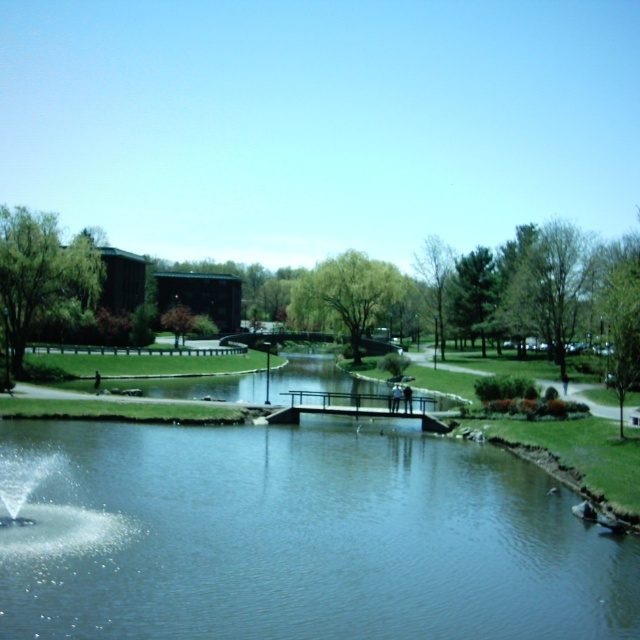
Which of these two, clear water at center or clear water fountain at lower left, stands shorter?

Standing shorter between the two is clear water fountain at lower left.

Can you confirm if clear water at center is positioned below clear water fountain at lower left?

Yes, clear water at center is below clear water fountain at lower left.

Does point (353, 465) lie in front of point (20, 531)?

No.

Where is `clear water at center`? The image size is (640, 640). clear water at center is located at coordinates (294, 538).